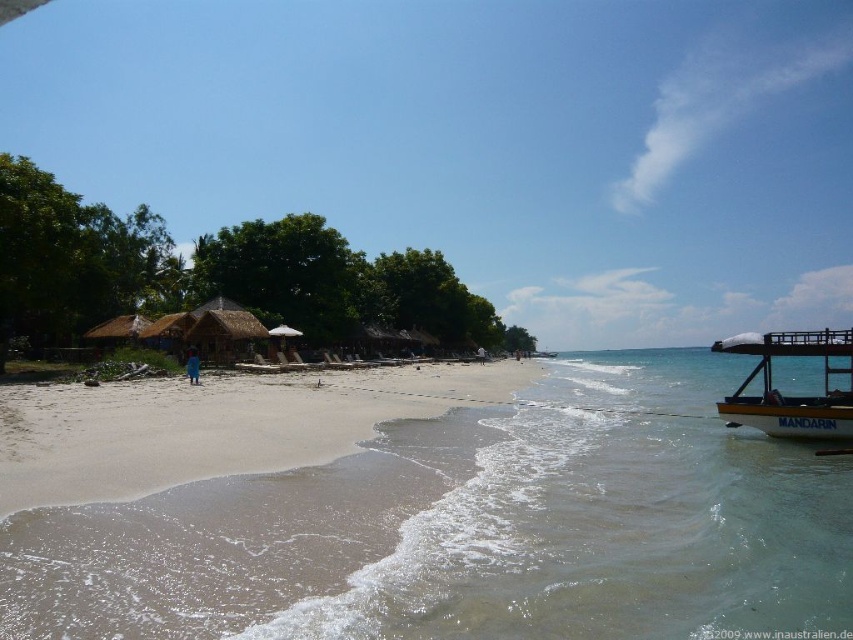
Question: Which point is farther to the camera?

Choices:
 (A) (268, 442)
 (B) (599, 461)

Answer: (B)

Question: Estimate the real-world distances between objects in this image. Which object is closer to the yellow wooden boat at right?

Choices:
 (A) sandy beach at lower left
 (B) blue fabric person at lower center
 (C) clear water at lower right

Answer: (C)

Question: Can you confirm if sandy beach at lower left is positioned to the left of yellow wooden boat at right?

Choices:
 (A) no
 (B) yes

Answer: (B)

Question: Where is clear water at lower right located in relation to sandy beach at lower left in the image?

Choices:
 (A) above
 (B) below

Answer: (B)

Question: Which point is farther to the camera?

Choices:
 (A) (714, 380)
 (B) (788, 419)
 (C) (190, 369)
 (D) (276, 568)

Answer: (A)

Question: From the image, what is the correct spatial relationship of clear water at lower right in relation to yellow wooden boat at right?

Choices:
 (A) above
 (B) below

Answer: (B)